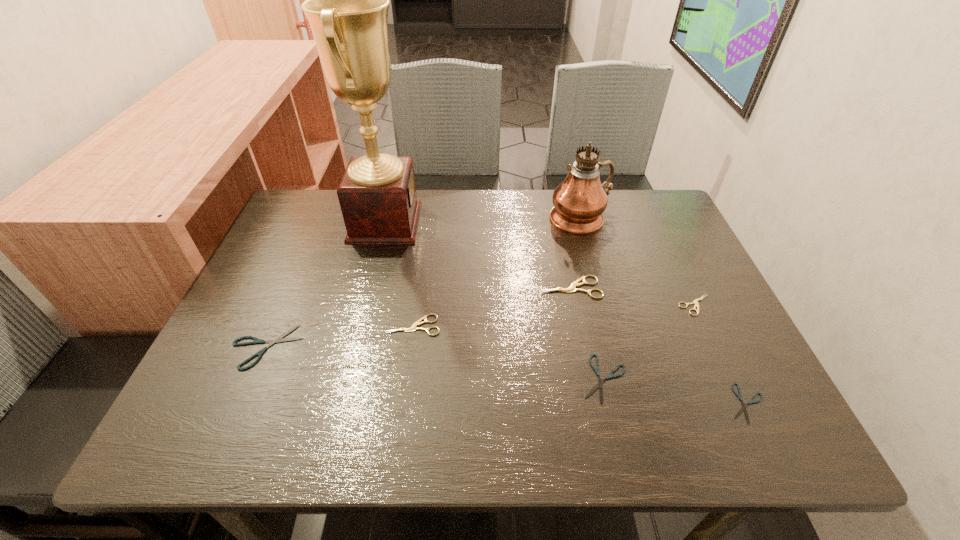
The width and height of the screenshot is (960, 540). In order to click on object that stands as the sixth closest to the leftmost black shears in this screenshot , I will do `click(695, 301)`.

Find the location of a particular element. Image resolution: width=960 pixels, height=540 pixels. object that is the fifth nearest to the biggest beige shears is located at coordinates (744, 408).

I want to click on the closest shears to the second smallest beige shears, so click(256, 341).

Find the location of a particular element. The image size is (960, 540). the fifth closest shears to the trophy cup is located at coordinates (695, 301).

You are a GUI agent. You are given a task and a screenshot of the screen. Output one action in this format:
    pyautogui.click(x=<x>, y=<y>)
    Task: Click on the third closest beige shears to the biggest black shears
    The height and width of the screenshot is (540, 960).
    Given the screenshot: What is the action you would take?
    pyautogui.click(x=695, y=301)

Identify the location of beige shears that is the second closest to the oil lamp. (695, 301).

Identify which black shears is located as the nearest to the rightmost black shears. Please provide its 2D coordinates. Your answer should be formatted as a tuple, i.e. [(x, y)], where the tuple contains the x and y coordinates of a point satisfying the conditions above.

[(600, 382)]

I want to click on black shears object that ranks as the second closest to the second biggest black shears, so click(x=256, y=341).

Where is `vacant space that satisfies the following two spatial constraints: 1. on the plaque of the trophy cup; 2. on the back side of the second smallest beige shears`? vacant space that satisfies the following two spatial constraints: 1. on the plaque of the trophy cup; 2. on the back side of the second smallest beige shears is located at coordinates (359, 325).

You are a GUI agent. You are given a task and a screenshot of the screen. Output one action in this format:
    pyautogui.click(x=<x>, y=<y>)
    Task: Click on the vacant space that satisfies the following two spatial constraints: 1. on the front side of the second tallest object; 2. on the right side of the shortest shears
    
    Given the screenshot: What is the action you would take?
    pyautogui.click(x=632, y=403)